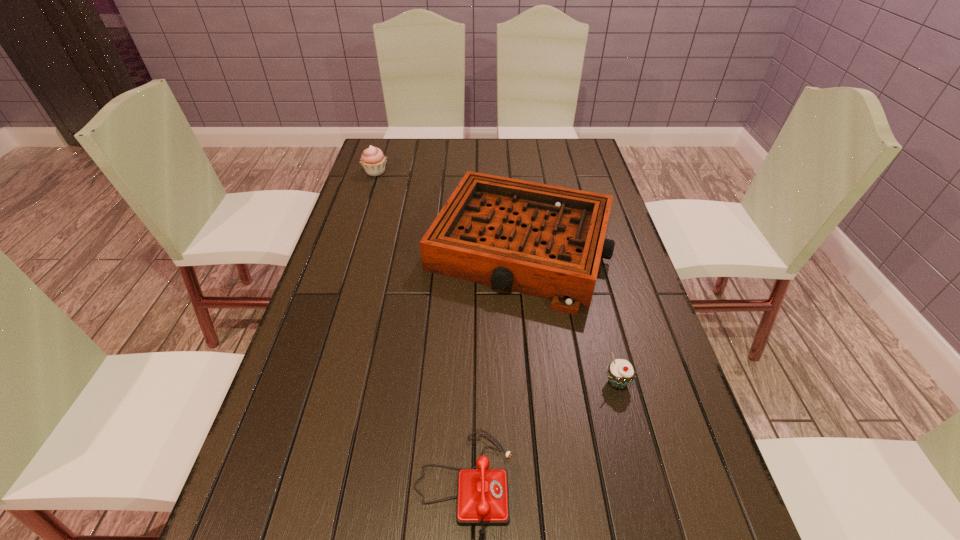
Locate an element on the screen. The height and width of the screenshot is (540, 960). the farthest object is located at coordinates (373, 160).

The height and width of the screenshot is (540, 960). Find the location of `the left cupcake`. the left cupcake is located at coordinates (373, 160).

In order to click on the third nearest object in this screenshot , I will do `click(546, 241)`.

I want to click on the shorter cupcake, so click(620, 372).

The image size is (960, 540). Find the location of `the right cupcake`. the right cupcake is located at coordinates (620, 372).

Where is `vacant area located 0.160m on the right of the leftmost object`? vacant area located 0.160m on the right of the leftmost object is located at coordinates (433, 172).

You are a GUI agent. You are given a task and a screenshot of the screen. Output one action in this format:
    pyautogui.click(x=<x>, y=<y>)
    Task: Click on the free point located on the back of the gameboard
    
    Given the screenshot: What is the action you would take?
    pyautogui.click(x=512, y=157)

You are a GUI agent. You are given a task and a screenshot of the screen. Output one action in this format:
    pyautogui.click(x=<x>, y=<y>)
    Task: Click on the vacant space located 0.180m on the back of the right cupcake
    The height and width of the screenshot is (540, 960).
    Given the screenshot: What is the action you would take?
    pyautogui.click(x=599, y=310)

You are a GUI agent. You are given a task and a screenshot of the screen. Output one action in this format:
    pyautogui.click(x=<x>, y=<y>)
    Task: Click on the object that is at the far edge
    The image size is (960, 540).
    Given the screenshot: What is the action you would take?
    pyautogui.click(x=373, y=160)

What are the coordinates of `object that is positioned at the left edge` in the screenshot? It's located at (373, 160).